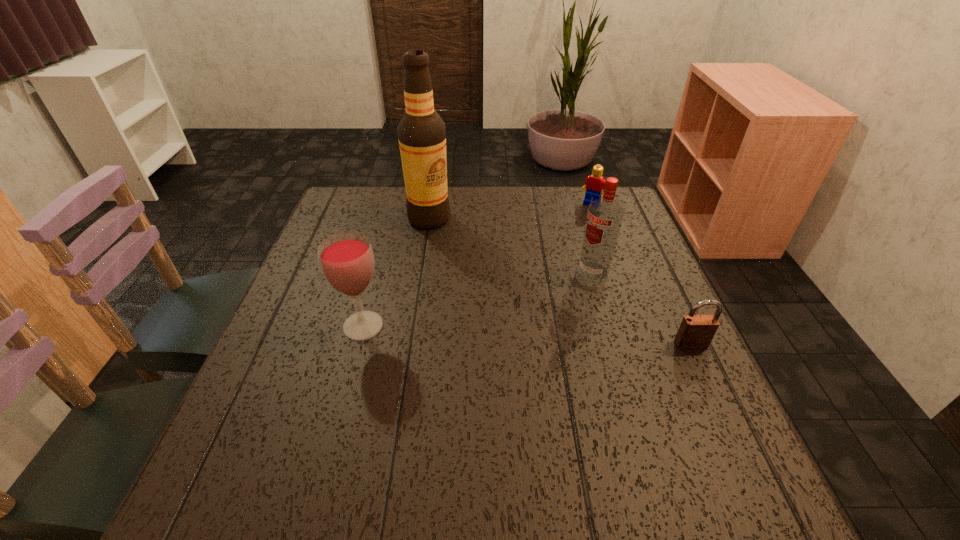
Find the location of `padlock that is at the right edge`. padlock that is at the right edge is located at coordinates (696, 331).

The image size is (960, 540). I want to click on vodka present at the right edge, so click(604, 217).

You are a GUI agent. You are given a task and a screenshot of the screen. Output one action in this format:
    pyautogui.click(x=<x>, y=<y>)
    Task: Click on the Lego present at the right edge
    The image size is (960, 540).
    Given the screenshot: What is the action you would take?
    pyautogui.click(x=594, y=184)

Identify the location of object that is at the far right corner. (594, 184).

In the image, there is a desktop. Where is `vacant space at the far edge`? The height and width of the screenshot is (540, 960). vacant space at the far edge is located at coordinates (404, 204).

The height and width of the screenshot is (540, 960). I want to click on vacant space at the near edge of the desktop, so pyautogui.click(x=527, y=443).

This screenshot has width=960, height=540. In the image, there is a desktop. Find the location of `blank space at the left edge`. blank space at the left edge is located at coordinates (292, 302).

This screenshot has width=960, height=540. I want to click on vacant area at the right edge, so click(607, 278).

Where is `free space at the far left corner`? The height and width of the screenshot is (540, 960). free space at the far left corner is located at coordinates (359, 194).

This screenshot has width=960, height=540. I want to click on free space between the padlock and the Lego, so click(x=641, y=274).